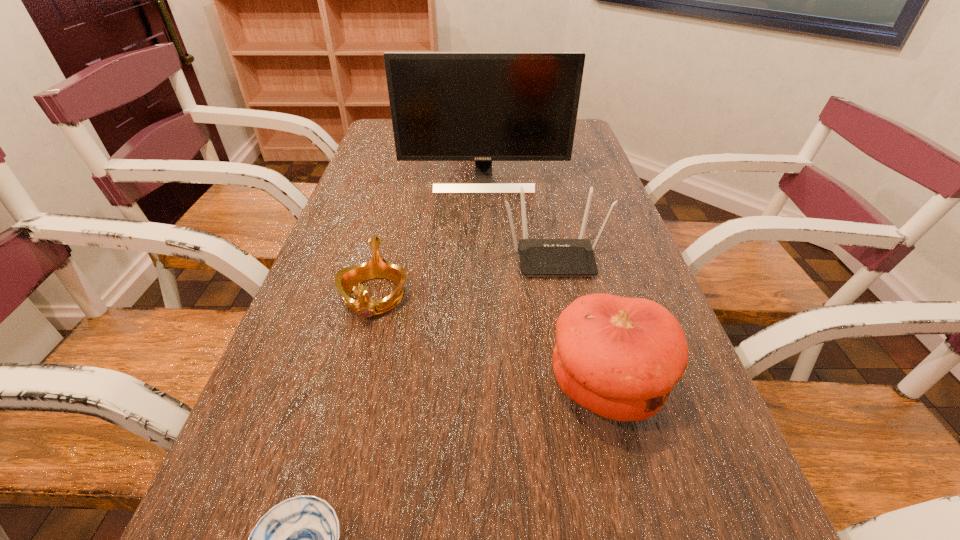
Locate an element on the screen. This screenshot has height=540, width=960. free area in between the second shortest object and the monitor is located at coordinates (429, 238).

You are a GUI agent. You are given a task and a screenshot of the screen. Output one action in this format:
    pyautogui.click(x=<x>, y=<y>)
    Task: Click on the vacant region between the tiara and the pumpkin
    Image resolution: width=960 pixels, height=540 pixels.
    Given the screenshot: What is the action you would take?
    pyautogui.click(x=491, y=341)

The image size is (960, 540). What are the coordinates of `object that is the second closest to the third shortest object` in the screenshot? It's located at (346, 280).

Where is `object that can be found as the fourth closest to the third shortest object`? The width and height of the screenshot is (960, 540). object that can be found as the fourth closest to the third shortest object is located at coordinates (298, 539).

Locate an element on the screen. free spot that satisfies the following two spatial constraints: 1. on the screen side of the fourth farthest object; 2. on the left side of the farthest object is located at coordinates (487, 387).